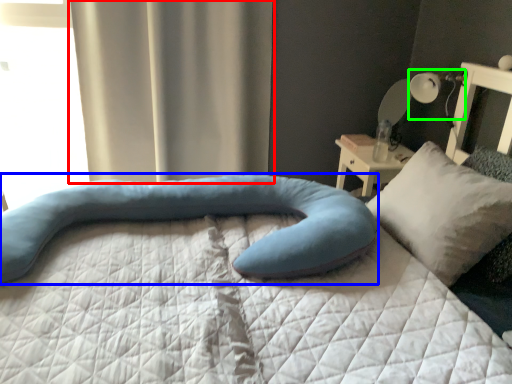
Question: Considering the real-world distances, which object is closest to curtain (highlighted by a red box)? pillow (highlighted by a blue box) or table lamp (highlighted by a green box).

Choices:
 (A) pillow
 (B) table lamp

Answer: (A)